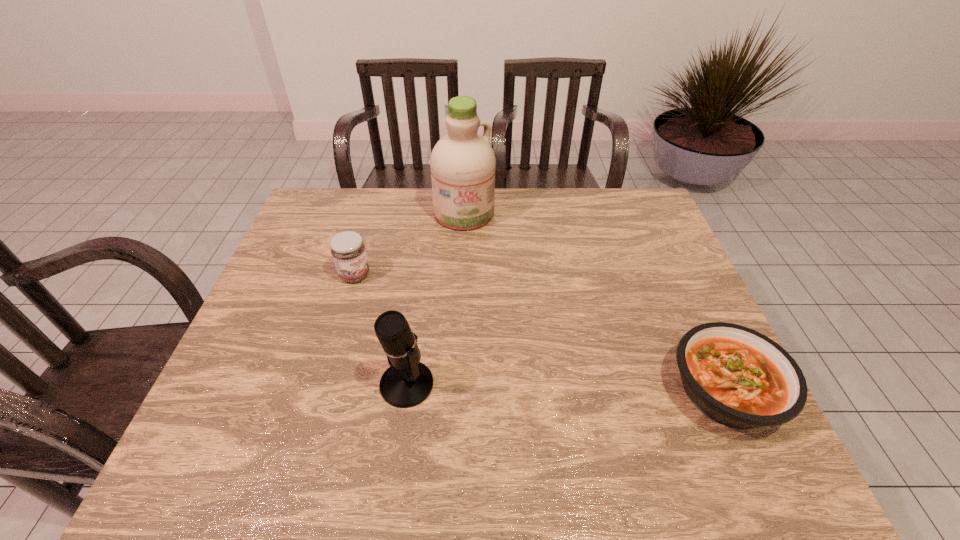
Where is `free spot on the desktop that is between the third shortest object and the shortest object and is positioned on the front label of the jam`? The height and width of the screenshot is (540, 960). free spot on the desktop that is between the third shortest object and the shortest object and is positioned on the front label of the jam is located at coordinates (532, 387).

At what (x,y) coordinates should I click in order to perform the action: click on free space on the desktop that is between the microphone and the stew and is positioned on the front label of the cleansing agent. Please return your answer as a coordinate pair (x, y). The width and height of the screenshot is (960, 540). Looking at the image, I should click on (542, 387).